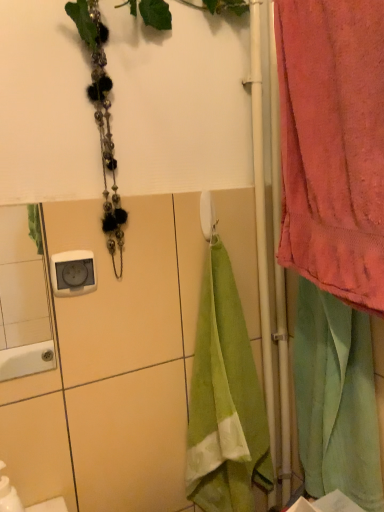
This screenshot has width=384, height=512. What do you see at coordinates (22, 301) in the screenshot?
I see `white glossy mirror at upper left` at bounding box center [22, 301].

At what (x,y) coordinates should I click in order to perform the action: click on white plastic towel bar at center. Please return your answer as a coordinate pair (x, y). The image size is (384, 512). Looking at the image, I should click on (207, 216).

The width and height of the screenshot is (384, 512). What do you see at coordinates (207, 216) in the screenshot? I see `white plastic towel bar at center` at bounding box center [207, 216].

Measure the distance between light green velour towel at right and camera.

light green velour towel at right and camera are 29.53 inches apart.

Locate an element on the screen. The height and width of the screenshot is (512, 384). pink cotton towel at right is located at coordinates (333, 145).

From a real-world perspective, is pink cotton towel at right beneath light green velour towel at right?

No.

Does point (285, 58) come farther from viewer compared to point (337, 313)?

No, (285, 58) is in front of (337, 313).

From the image's perspective, does pink cotton towel at right appear lower than light green velour towel at right?

No, from the image's perspective, pink cotton towel at right is not below light green velour towel at right.

Looking at this image, in the image, is white glossy mirror at upper left on the left side or the right side of white glossy electric outlet at upper left?

Based on their positions, white glossy mirror at upper left is located to the left of white glossy electric outlet at upper left.

From the picture: Could you tell me if white glossy mirror at upper left is facing white glossy electric outlet at upper left?

No, white glossy mirror at upper left is not facing towards white glossy electric outlet at upper left.

Identify the location of mirror that appears in front of the white glossy electric outlet at upper left. The height and width of the screenshot is (512, 384). (22, 301).

The height and width of the screenshot is (512, 384). I want to click on mirror behind the pink cotton towel at right, so click(x=22, y=301).

Is point (0, 245) positioned behind point (342, 270)?

Yes, it is behind point (342, 270).

From the image's perspective, which object appears higher, white glossy mirror at upper left or pink cotton towel at right?

pink cotton towel at right, from the image's perspective.

Who is bigger, white glossy mirror at upper left or pink cotton towel at right?

pink cotton towel at right.

Which of these two, white plastic towel bar at center or pink cotton towel at right, stands shorter?

white plastic towel bar at center.

From a real-world perspective, who is located higher, white plastic towel bar at center or pink cotton towel at right?

pink cotton towel at right, from a real-world perspective.

Consider the image. From the image's perspective, which one is positioned higher, white plastic towel bar at center or pink cotton towel at right?

pink cotton towel at right appears higher in the image.

Is pink cotton towel at right surrounded by white plastic towel bar at center?

That's incorrect, pink cotton towel at right is not inside white plastic towel bar at center.

Considering the relative sizes of pink cotton towel at right and white glossy mirror at upper left in the image provided, is pink cotton towel at right shorter than white glossy mirror at upper left?

No, pink cotton towel at right is not shorter than white glossy mirror at upper left.

From the image's perspective, which is above, pink cotton towel at right or white glossy mirror at upper left?

pink cotton towel at right is shown above in the image.

From the picture: Considering the sizes of pink cotton towel at right and white glossy mirror at upper left in the image, is pink cotton towel at right bigger or smaller than white glossy mirror at upper left?

Considering their sizes, pink cotton towel at right takes up more space than white glossy mirror at upper left.

Considering the sizes of objects white glossy mirror at upper left and light green velour towel at right in the image provided, who is taller, white glossy mirror at upper left or light green velour towel at right?

light green velour towel at right.

From a real-world perspective, is white glossy mirror at upper left physically located above or below light green velour towel at right?

From a real-world perspective, white glossy mirror at upper left is physically above light green velour towel at right.

From the image's perspective, which one is positioned higher, white glossy mirror at upper left or light green velour towel at right?

From the image's view, white glossy mirror at upper left is above.

Is the surface of white glossy mirror at upper left in direct contact with light green velour towel at right?

No, white glossy mirror at upper left is not beside light green velour towel at right.

From the picture: Is pink cotton towel at right next to white glossy electric outlet at upper left and touching it?

No, pink cotton towel at right is not with white glossy electric outlet at upper left.

Measure the distance from pink cotton towel at right to white glossy electric outlet at upper left.

pink cotton towel at right and white glossy electric outlet at upper left are 45.90 centimeters apart from each other.

Is white glossy electric outlet at upper left completely or partially inside pink cotton towel at right?

No, white glossy electric outlet at upper left is located outside of pink cotton towel at right.

The width and height of the screenshot is (384, 512). Find the location of `curtain in front of the light green velour towel at right`. curtain in front of the light green velour towel at right is located at coordinates (333, 145).

This screenshot has width=384, height=512. Identify the location of mirror that appears below the white glossy electric outlet at upper left (from a real-world perspective). (22, 301).

Estimate the real-world distances between objects in this image. Which object is further from white plastic towel bar at center, white glossy electric outlet at upper left or white glossy mirror at upper left?

Based on the image, white glossy mirror at upper left appears to be further to white plastic towel bar at center.

Based on their spatial positions, is white glossy mirror at upper left or white glossy electric outlet at upper left further from pink cotton towel at right?

Among the two, white glossy mirror at upper left is located further to pink cotton towel at right.

Based on their spatial positions, is white plastic towel bar at center or white glossy mirror at upper left closer to pink cotton towel at right?

Among the two, white plastic towel bar at center is located nearer to pink cotton towel at right.

Which object lies nearer to the anchor point white plastic towel bar at center, pink cotton towel at right or light green velour towel at right?

The object closer to white plastic towel bar at center is pink cotton towel at right.

Which object lies nearer to the anchor point white plastic towel bar at center, white glossy electric outlet at upper left or light green velour towel at right?

white glossy electric outlet at upper left is closer to white plastic towel bar at center.

Looking at the image, which one is located further to white glossy mirror at upper left, light green velour towel at right or pink cotton towel at right?

pink cotton towel at right.

From the image, which object appears to be farther from white glossy electric outlet at upper left, white plastic towel bar at center or white glossy mirror at upper left?

white glossy mirror at upper left is further to white glossy electric outlet at upper left.

When comparing their distances from light green velour towel at right, does white plastic towel bar at center or white glossy mirror at upper left seem further?

white glossy mirror at upper left is further to light green velour towel at right.

This screenshot has width=384, height=512. Identify the location of curtain situated between white glossy electric outlet at upper left and light green velour towel at right from left to right. (333, 145).

Where is `electric outlet between white glossy mirror at upper left and white plastic towel bar at center in the horizontal direction`? electric outlet between white glossy mirror at upper left and white plastic towel bar at center in the horizontal direction is located at coordinates (73, 273).

Where is `towel bar between white glossy electric outlet at upper left and light green velour towel at right`? towel bar between white glossy electric outlet at upper left and light green velour towel at right is located at coordinates (207, 216).

Identify the location of electric outlet located between white glossy mirror at upper left and light green velour towel at right in the left-right direction. (73, 273).